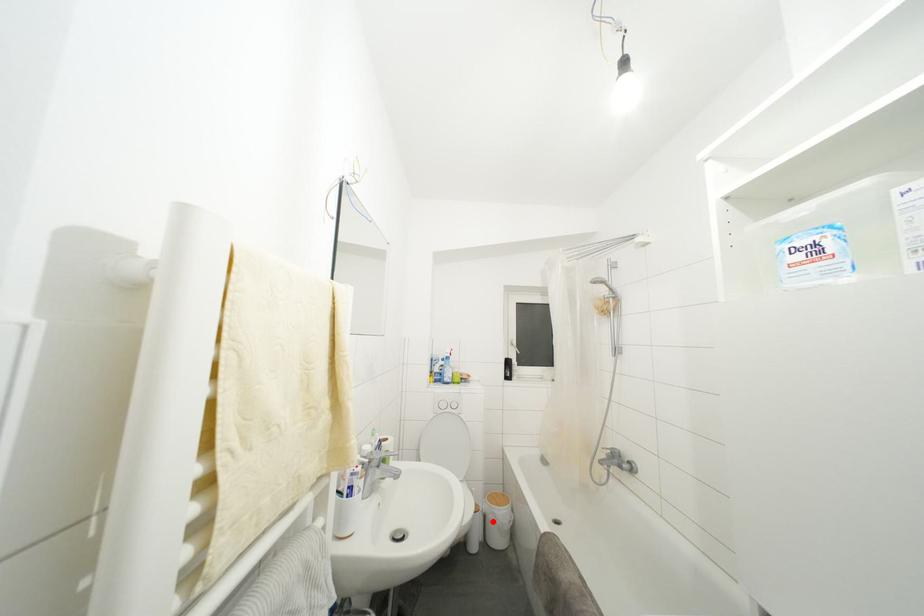
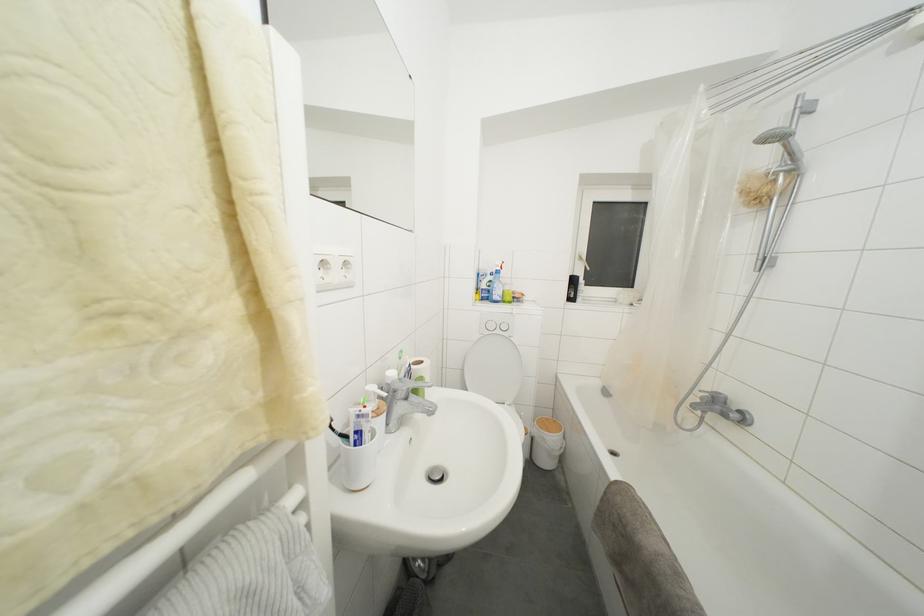
Question: I am providing you with two images of the same scene from different viewpoints. In image1, a red point is highlighted. Considering the same 3D point in image2, which of the following is correct?

Choices:
 (A) It is closer
 (B) It is farther

Answer: (B)